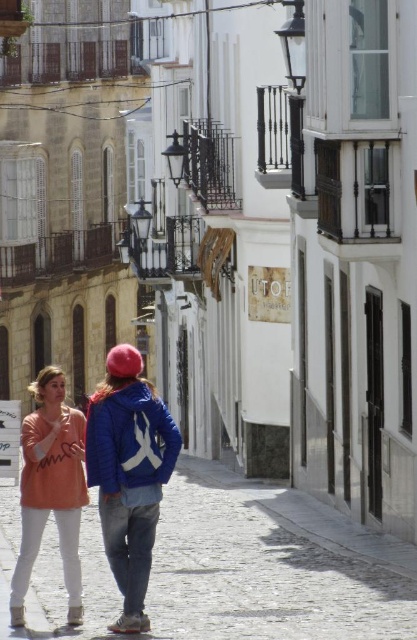
Question: Which of these objects is positioned farthest from the matte peach sweater at center?

Choices:
 (A) matte peach sweatshirt at lower left
 (B) blue denim jacket at center
 (C) blue fleece sweatshirt at center

Answer: (C)

Question: Is matte peach sweater at center wider than blue fleece sweatshirt at center?

Choices:
 (A) yes
 (B) no

Answer: (A)

Question: Among these points, which one is nearest to the camera?

Choices:
 (A) (45, 445)
 (B) (379, 570)
 (C) (47, 496)
 (D) (102, 451)

Answer: (D)

Question: Is cobblestone pavement at lower center positioned at the back of blue denim jacket at center?

Choices:
 (A) no
 (B) yes

Answer: (A)

Question: Is cobblestone pavement at lower center positioned behind matte peach sweatshirt at lower left?

Choices:
 (A) no
 (B) yes

Answer: (A)

Question: Based on their relative distances, which object is farther from the blue denim jacket at center?

Choices:
 (A) matte peach sweater at center
 (B) cobblestone pavement at lower center
 (C) matte peach sweatshirt at lower left
 (D) blue fleece sweatshirt at center

Answer: (B)